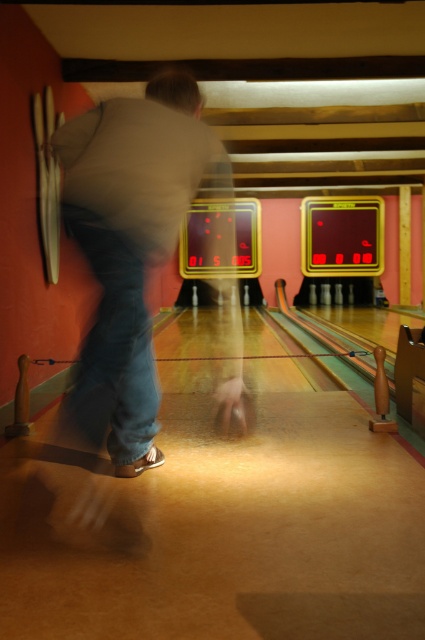
Which is in front, point (96, 218) or point (96, 228)?

Point (96, 218) is more forward.

Can you confirm if light brown casual clothing at center is thinner than denim at center?

No.

Between point (107, 202) and point (150, 444), which one is positioned behind?

The point (150, 444) is behind.

You are a GUI agent. You are given a task and a screenshot of the screen. Output one action in this format:
    pyautogui.click(x=<x>, y=<y>)
    Task: Click on the light brown casual clothing at center
    
    Given the screenshot: What is the action you would take?
    pyautogui.click(x=130, y=246)